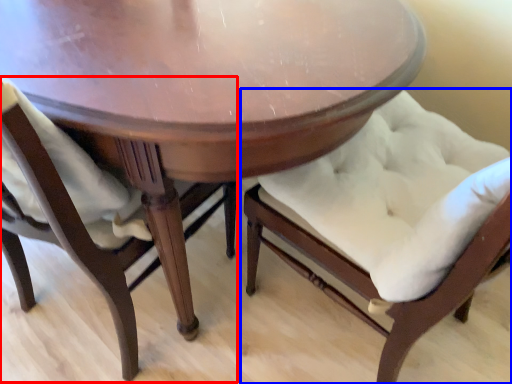
Question: Which object appears closest to the camera in this image, chair (highlighted by a red box) or chair (highlighted by a blue box)?

Choices:
 (A) chair
 (B) chair

Answer: (B)